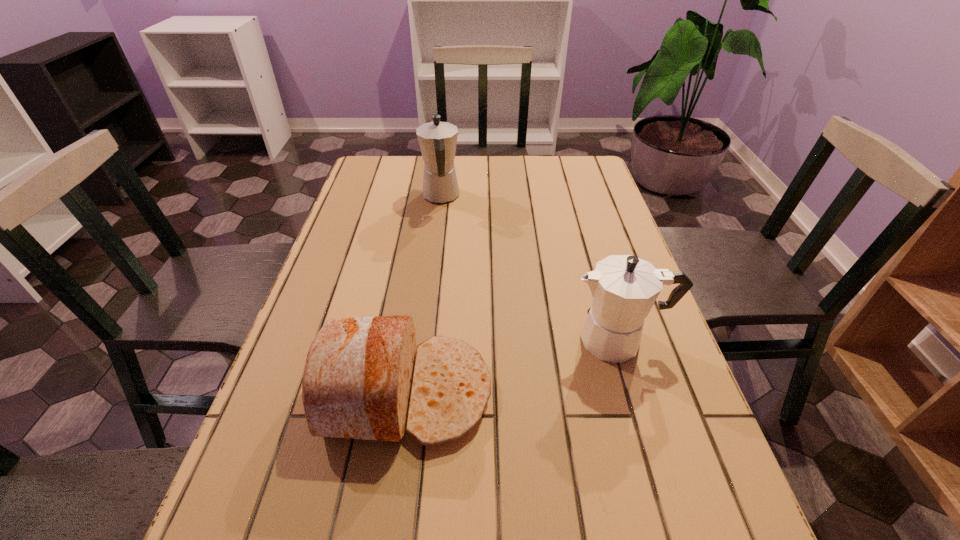
This screenshot has width=960, height=540. In order to click on free spot that satisfies the following two spatial constraints: 1. on the front side of the left coffeepot; 2. at the sliced end of the shortest object in this screenshot , I will do `click(417, 392)`.